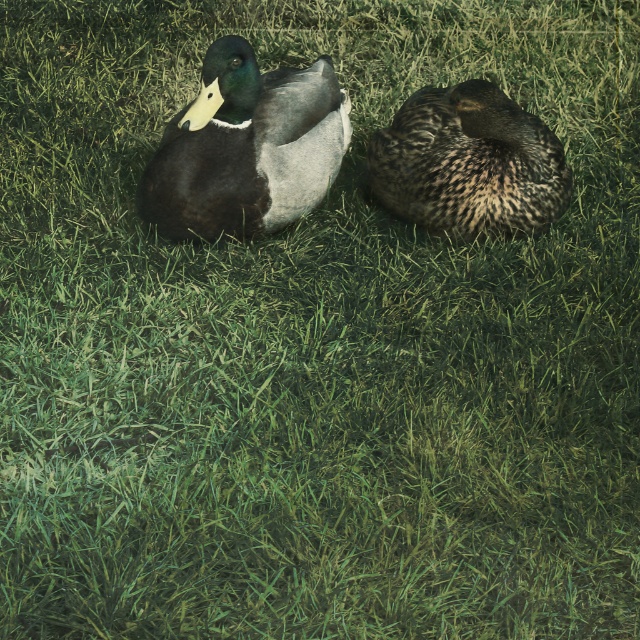
Question: Can you confirm if shiny green duck at upper left is positioned above speckled feathered duck at right?

Choices:
 (A) no
 (B) yes

Answer: (B)

Question: Does shiny green duck at upper left appear over speckled feathered duck at right?

Choices:
 (A) yes
 (B) no

Answer: (A)

Question: Which point appears closest to the camera in this image?

Choices:
 (A) (323, 112)
 (B) (413, 157)

Answer: (B)

Question: Among these objects, which one is nearest to the camera?

Choices:
 (A) shiny green duck at upper left
 (B) speckled feathered duck at right

Answer: (A)

Question: Does shiny green duck at upper left appear under speckled feathered duck at right?

Choices:
 (A) yes
 (B) no

Answer: (B)